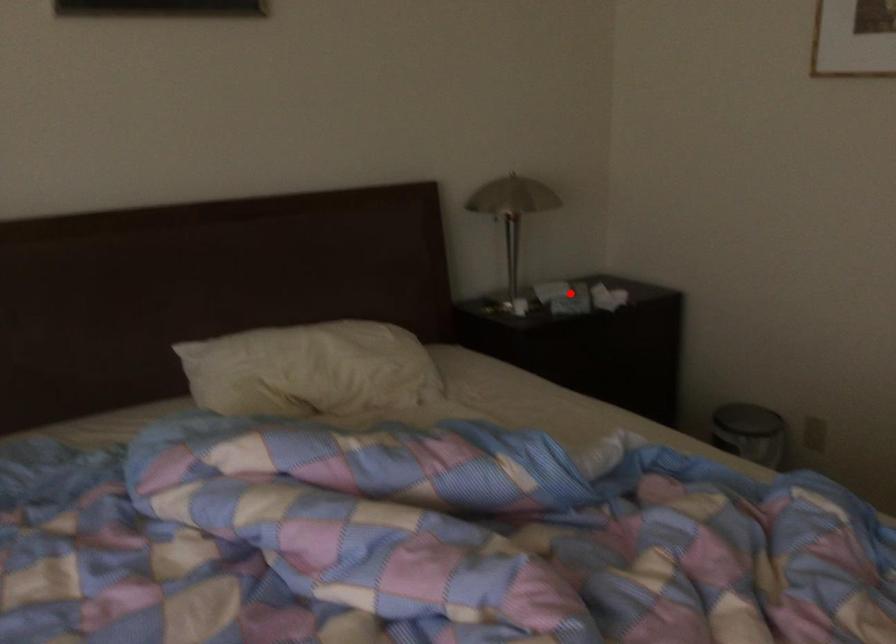
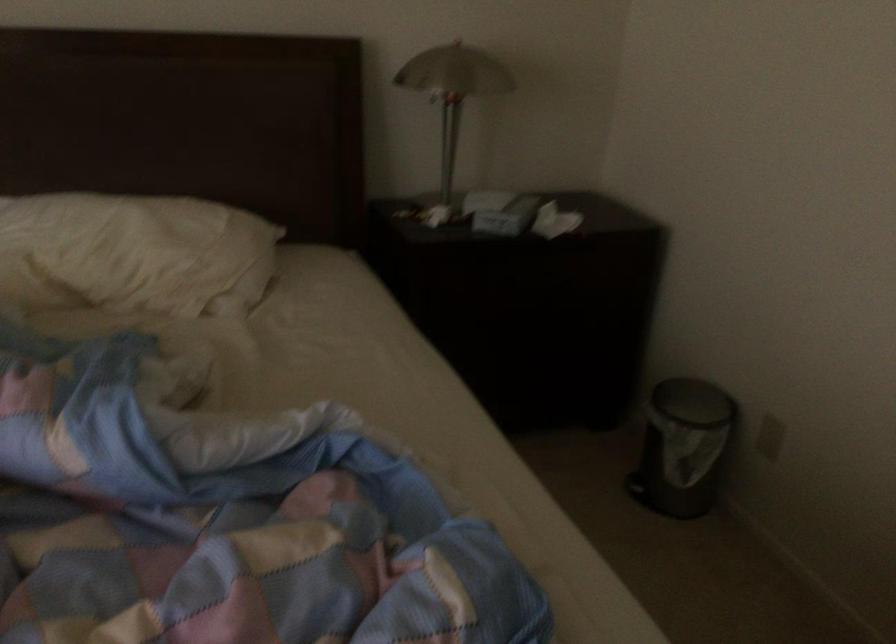
Question: I am providing you with two images of the same scene from different viewpoints. Given a red point in image1, look at the same physical point in image2. Is it:

Choices:
 (A) Closer to the viewpoint
 (B) Farther from the viewpoint

Answer: (A)